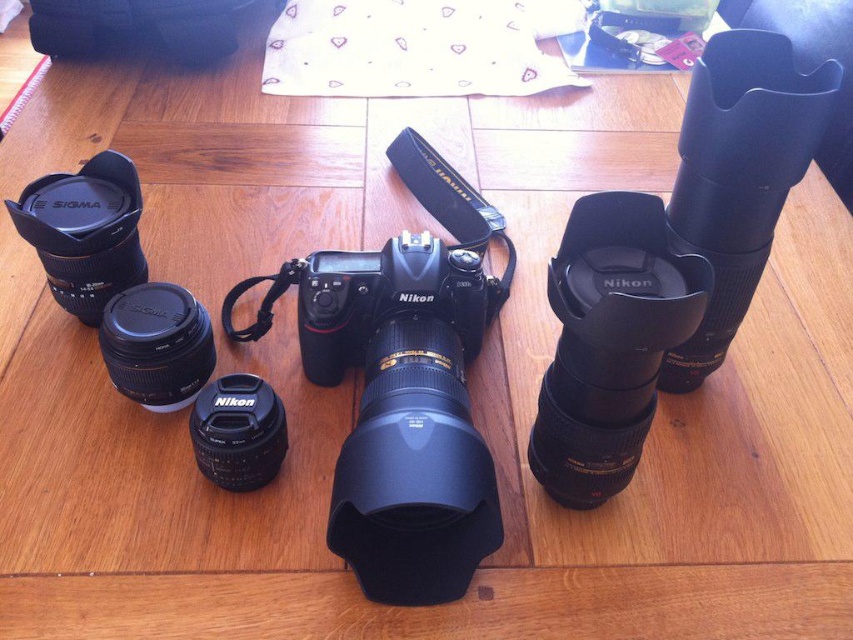
Question: Which object appears closest to the camera in this image?

Choices:
 (A) black rubberized lens at upper right
 (B) matte black lens at left

Answer: (A)

Question: Which object appears closest to the camera in this image?

Choices:
 (A) matte black lens at left
 (B) black rubber lens cap at lower center
 (C) black rubberized lens at upper right

Answer: (C)

Question: Considering the relative positions of matte black lens at left and matte black lens at lower left in the image provided, where is matte black lens at left located with respect to matte black lens at lower left?

Choices:
 (A) above
 (B) below

Answer: (A)

Question: Does black rubberized lens at upper right appear on the right side of black rubber lens cap at lower center?

Choices:
 (A) yes
 (B) no

Answer: (A)

Question: Which of the following is the closest to the observer?

Choices:
 (A) black rubberized lens at upper right
 (B) black rubber lens cap at lower center
 (C) matte black lens at left

Answer: (A)

Question: Considering the relative positions of black rubberized lens at upper right and matte black lens at left in the image provided, where is black rubberized lens at upper right located with respect to matte black lens at left?

Choices:
 (A) right
 (B) left

Answer: (A)